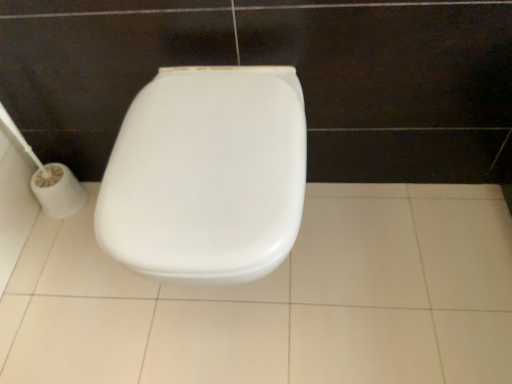
Locate an element on the screen. Image resolution: width=512 pixels, height=384 pixels. free spot above white glossy tile at center (from a real-world perspective) is located at coordinates (286, 292).